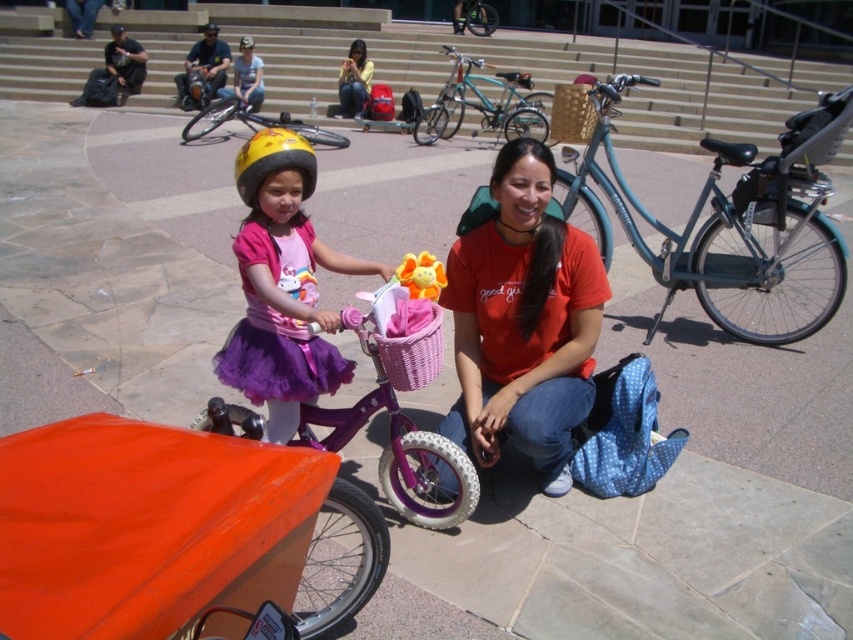
How much distance is there between matte red t-shirt at center and woven bamboo basket at center?

matte red t-shirt at center is 7.97 meters away from woven bamboo basket at center.

Is matte red t-shirt at center wider than woven bamboo basket at center?

In fact, matte red t-shirt at center might be narrower than woven bamboo basket at center.

Is point (581, 275) farther from camera compared to point (579, 113)?

No.

In order to click on matte red t-shirt at center in this screenshot , I will do `click(523, 321)`.

Can you confirm if teal matte bicycle at center-right is positioned to the right of teal matte bicycle at center?

Indeed, teal matte bicycle at center-right is positioned on the right side of teal matte bicycle at center.

Is teal matte bicycle at center-right above teal matte bicycle at center?

Actually, teal matte bicycle at center-right is below teal matte bicycle at center.

Which is in front, point (700, 204) or point (544, 128)?

Point (700, 204) is more forward.

Where is `teal matte bicycle at center-right`? teal matte bicycle at center-right is located at coordinates (724, 211).

Which of these two, matte pink bicycle at center or yellow matte helmet at center, stands taller?

matte pink bicycle at center

Does matte pink bicycle at center appear under yellow matte helmet at center?

Yes.

Image resolution: width=853 pixels, height=640 pixels. What do you see at coordinates (282, 285) in the screenshot? I see `matte pink bicycle at center` at bounding box center [282, 285].

The image size is (853, 640). In order to click on matte pink bicycle at center in this screenshot , I will do `click(282, 285)`.